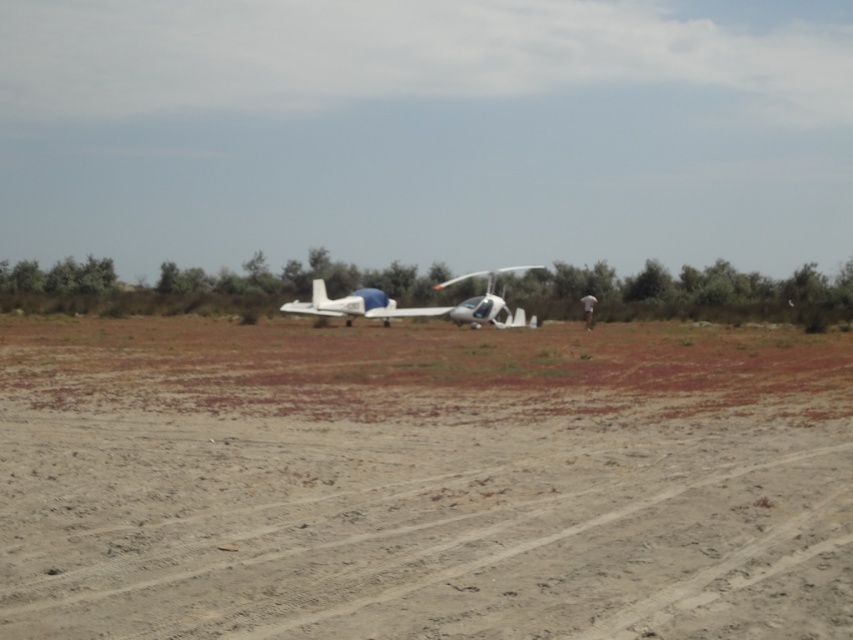
Is dirt at center positioned at the back of metallic silver helicopter at center?

→ No, dirt at center is in front of metallic silver helicopter at center.

Can you confirm if dirt at center is shorter than metallic silver helicopter at center?

Yes, dirt at center is shorter than metallic silver helicopter at center.

I want to click on dirt at center, so click(422, 481).

Can you confirm if white matte airplane at center is wider than metallic silver helicopter at center?

Yes.

Locate an element on the screen. The height and width of the screenshot is (640, 853). white matte airplane at center is located at coordinates (357, 305).

Is dirt at center smaller than white matte airplane at center?

Correct, dirt at center occupies less space than white matte airplane at center.

Does dirt at center appear under white matte airplane at center?

Correct, dirt at center is located below white matte airplane at center.

Describe the element at coordinates (422, 481) in the screenshot. I see `dirt at center` at that location.

At what (x,y) coordinates should I click in order to perform the action: click on dirt at center. Please return your answer as a coordinate pair (x, y). Looking at the image, I should click on (422, 481).